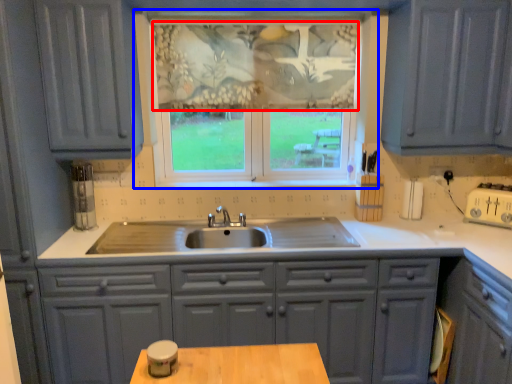
Question: Among these objects, which one is nearest to the camera, curtain (highlighted by a red box) or window (highlighted by a blue box)?

Choices:
 (A) curtain
 (B) window

Answer: (B)